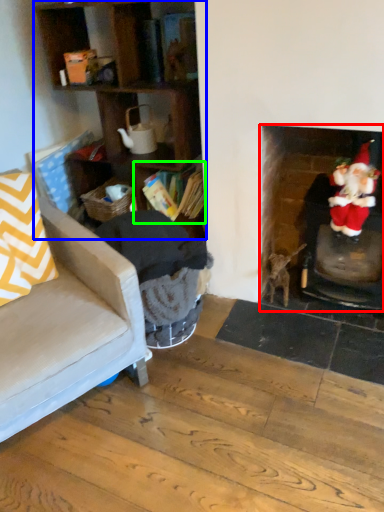
Question: Which is farther away from fireplace (highlighted by a red box)? cabinetry (highlighted by a blue box) or shelf (highlighted by a green box)?

Choices:
 (A) cabinetry
 (B) shelf

Answer: (A)